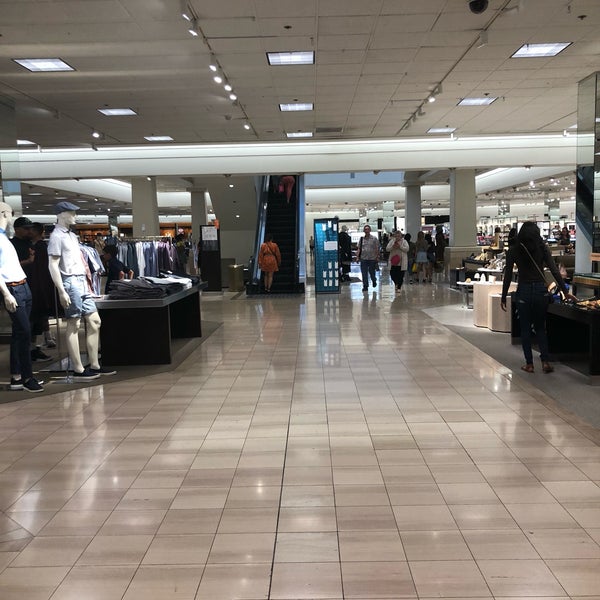
Find the location of a particular element. columns is located at coordinates (463, 201), (416, 200), (149, 218), (195, 213).